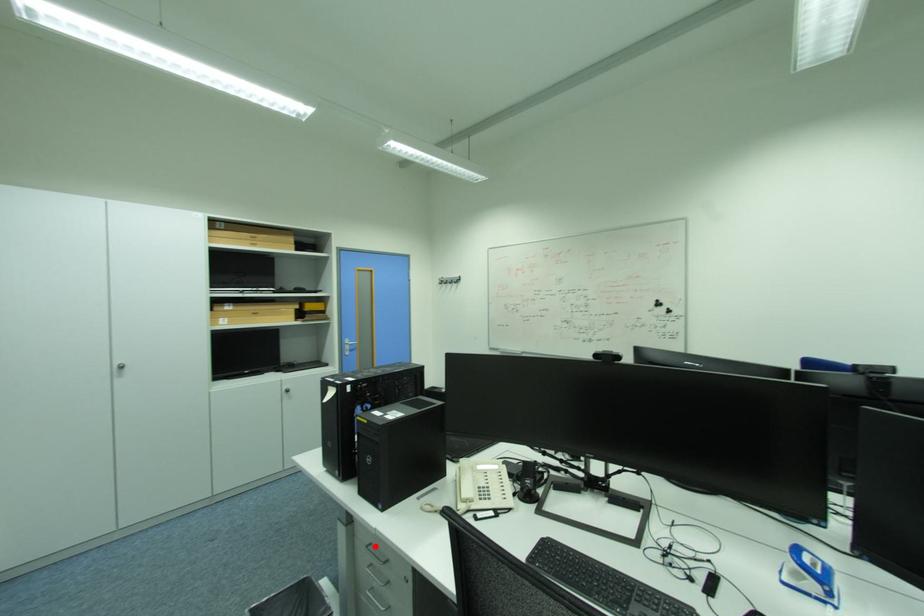
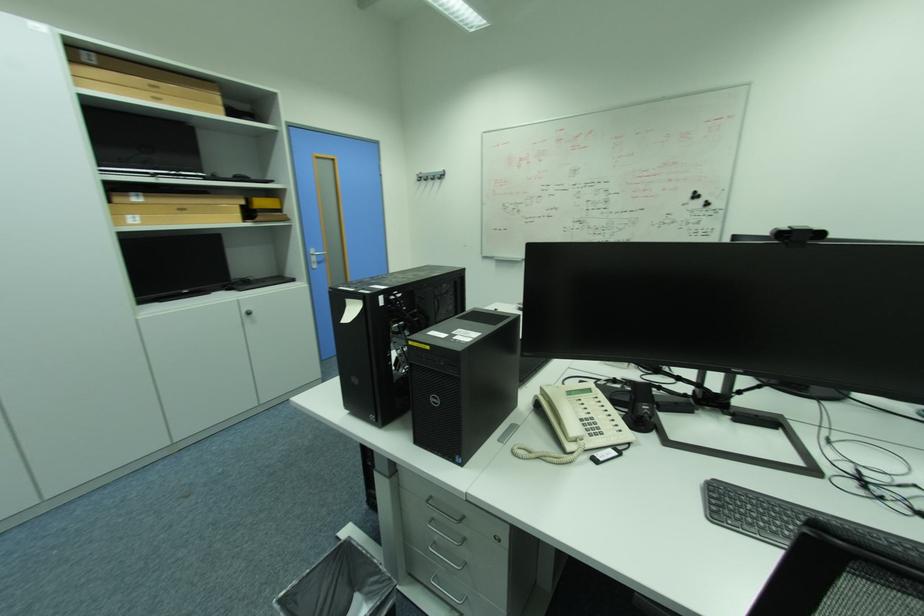
Question: I am providing you with two images of the same scene from different viewpoints. In image1, a red point is highlighted. Considering the same 3D point in image2, which of the following is correct?

Choices:
 (A) It is closer
 (B) It is farther

Answer: (A)